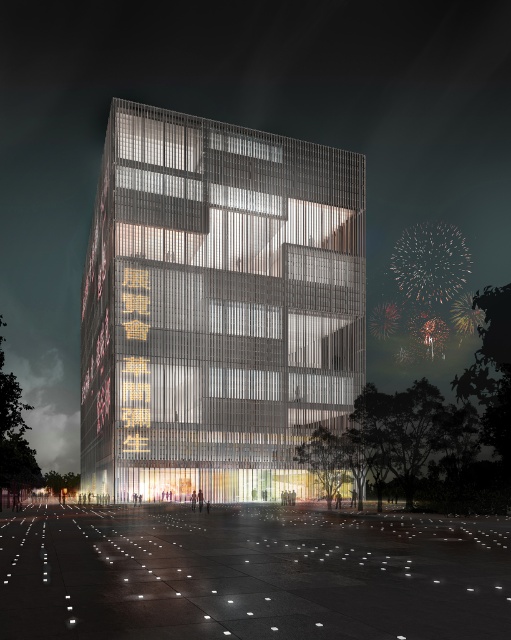
Question: Which point is farther to the camera?

Choices:
 (A) metallic glass tower at center
 (B) white concrete plaza at lower center

Answer: (A)

Question: Can you confirm if metallic glass tower at center is positioned to the right of white concrete plaza at lower center?

Choices:
 (A) no
 (B) yes

Answer: (A)

Question: Does metallic glass tower at center lie in front of white concrete plaza at lower center?

Choices:
 (A) no
 (B) yes

Answer: (A)

Question: Which point is farther to the camera?

Choices:
 (A) (196, 362)
 (B) (446, 532)

Answer: (A)

Question: Which object appears closest to the camera in this image?

Choices:
 (A) metallic glass tower at center
 (B) white concrete plaza at lower center

Answer: (B)

Question: Is metallic glass tower at center positioned in front of white concrete plaza at lower center?

Choices:
 (A) yes
 (B) no

Answer: (B)